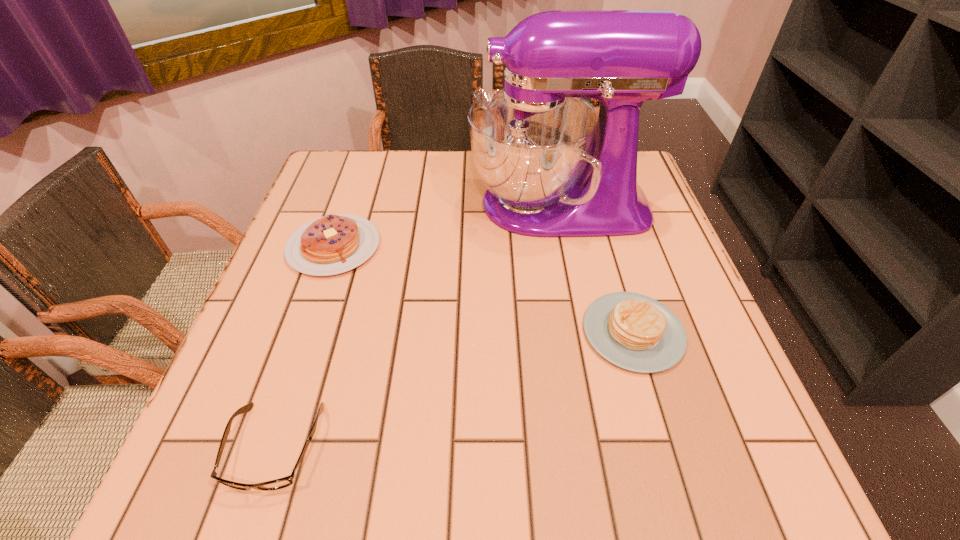
Where is `mixer`? mixer is located at coordinates (553, 167).

In order to click on the right pancake in this screenshot , I will do `click(635, 332)`.

The image size is (960, 540). What are the coordinates of `the nearer pancake` in the screenshot? It's located at (635, 332).

At what (x,y) coordinates should I click in order to perform the action: click on the farther pancake. Please return your answer as a coordinate pair (x, y). The image size is (960, 540). Looking at the image, I should click on (335, 243).

This screenshot has height=540, width=960. I want to click on the nearest object, so click(284, 482).

Find the location of a particular element. vacant position located 0.340m at the bowl opening of the tallest object is located at coordinates (334, 205).

Locate an element on the screen. free location located at the bowl opening of the tallest object is located at coordinates tap(374, 205).

Find the location of a particular element. free point located at the bowl opening of the tallest object is located at coordinates (406, 205).

I want to click on free point located on the left of the right pancake, so click(536, 332).

The width and height of the screenshot is (960, 540). Find the location of `free spot located 0.130m on the front of the farther pancake`. free spot located 0.130m on the front of the farther pancake is located at coordinates (305, 329).